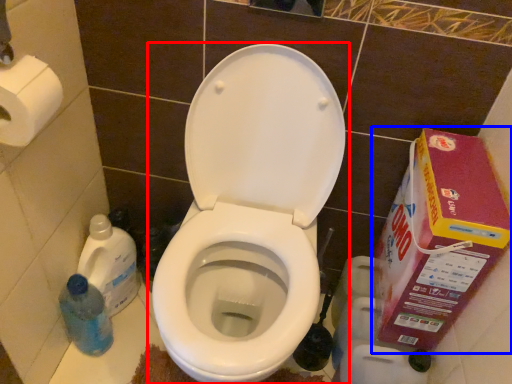
Question: Which object appears closest to the camera in this image, toilet (highlighted by a red box) or cardboard box (highlighted by a blue box)?

Choices:
 (A) toilet
 (B) cardboard box

Answer: (A)